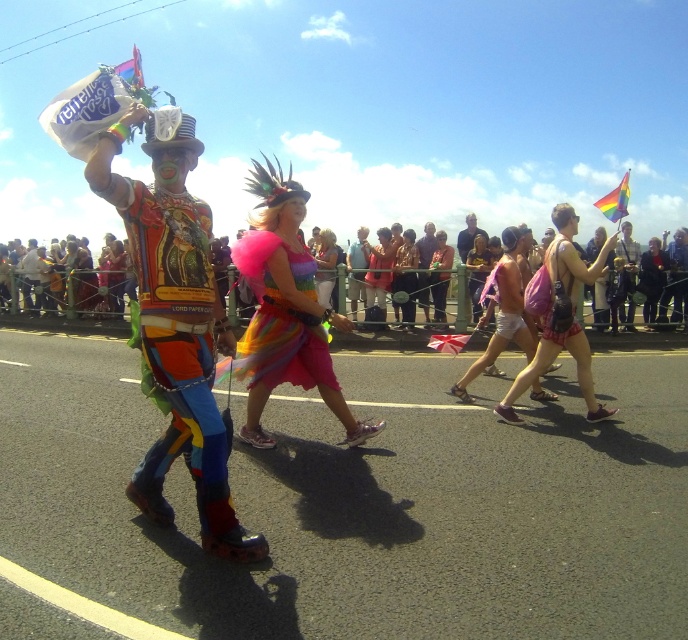
You are a photographer standing at the center of the parade. You want to take a photo that includes both the point at coordinates point(286, 369) and point(572, 321). Which point should you focus on first to ensure both are in frame?

Since point(286, 369) is in front of point(572, 321), you should focus on point(286, 369) first to ensure both are in frame.

You are a photographer trying to capture the vibrant costumes in the parade. You want to ensure you frame both the multicolored fabric costume at center and the rainbow tulle dress at center correctly. Which costume should you position on the left side of your frame to match their actual positions in the scene?

You should position the multicolored fabric costume at center on the left side of your frame because it is located to the left of the rainbow tulle dress at center in the scene.